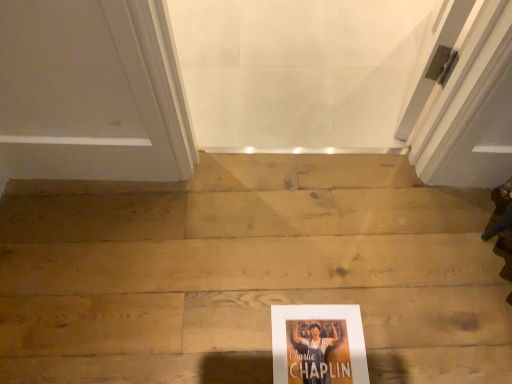
This screenshot has height=384, width=512. I want to click on free space above matte paper charlie chaplin poster at lower center (from a real-world perspective), so [x=314, y=348].